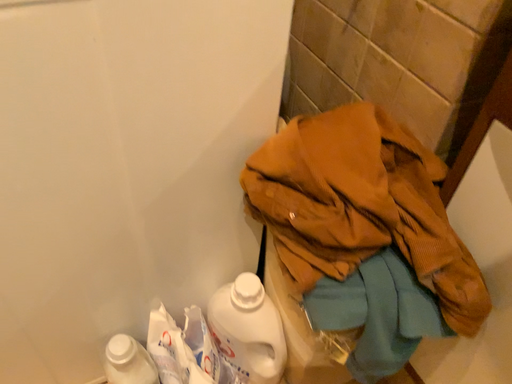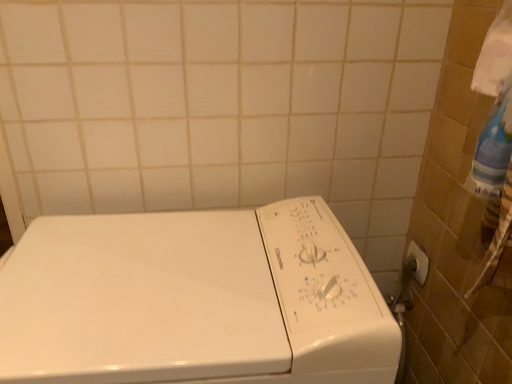
Question: Which way did the camera rotate in the video?

Choices:
 (A) rotated upward
 (B) rotated downward

Answer: (A)